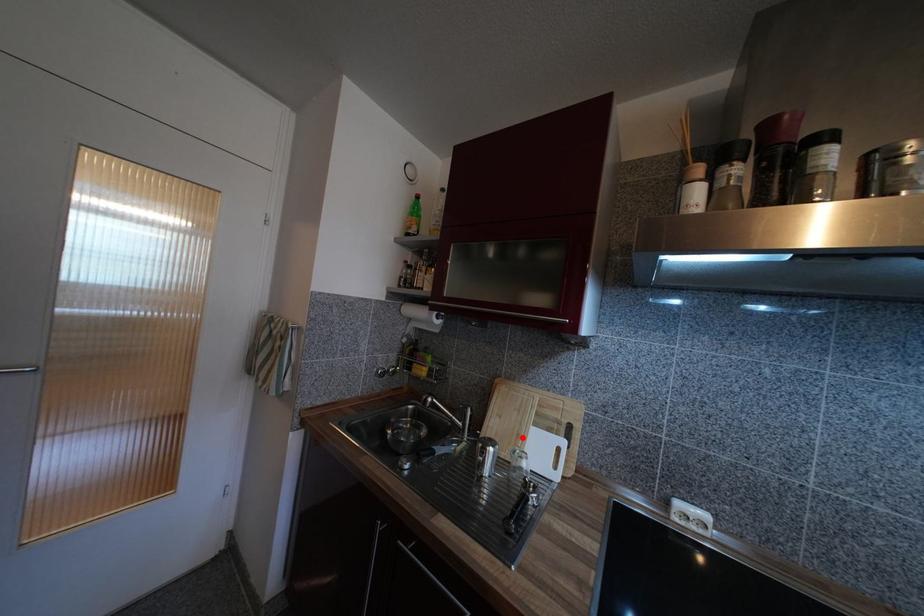
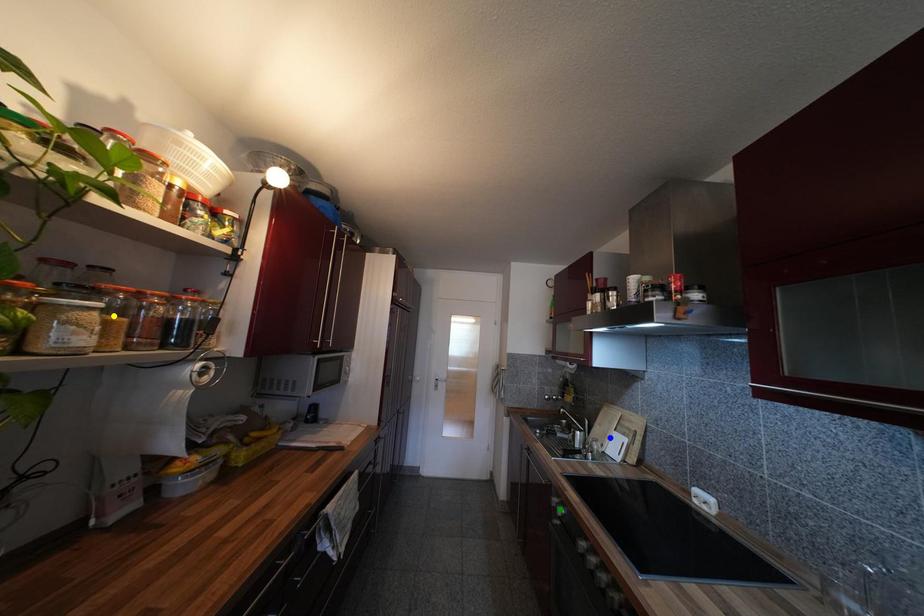
Question: I am providing you with two images of the same scene from different viewpoints. A red point is marked on the first image. You are given multiple points on the second image. Can you choose the point in image 2 that corresponds to the point in image 1?

Choices:
 (A) blue point
 (B) green point
 (C) yellow point

Answer: (A)